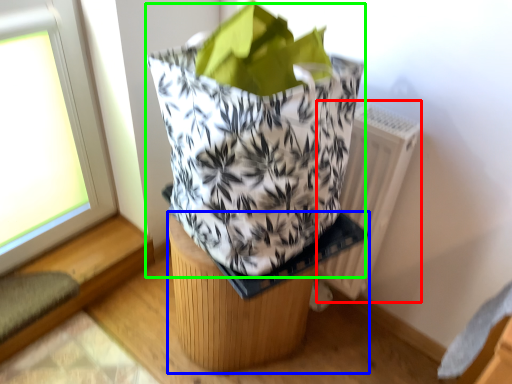
Question: Which object is the closest to the radiator (highlighted by a red box)? Choose among these: furniture (highlighted by a blue box) or grocery bag (highlighted by a green box).

Choices:
 (A) furniture
 (B) grocery bag

Answer: (A)